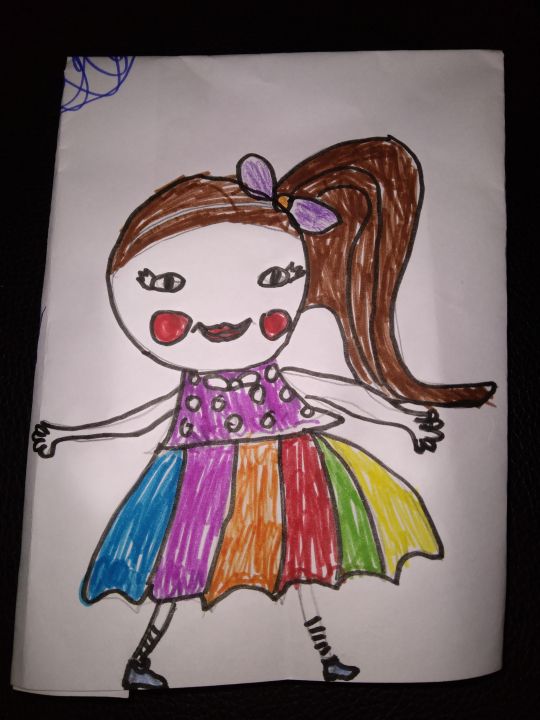
Find the location of a particular element. The image size is (540, 720). child's marker drawing is located at coordinates (73, 65).